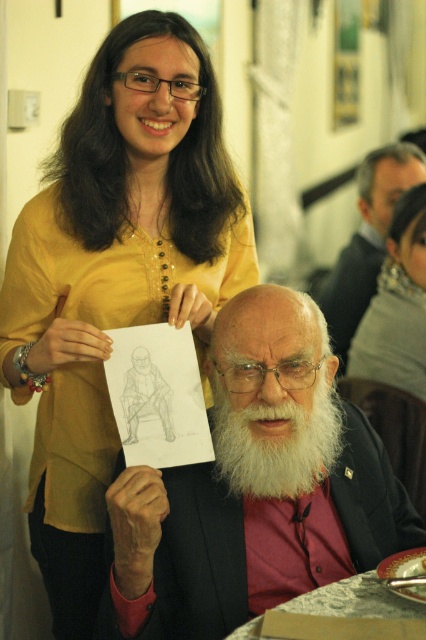
Can you confirm if white fluffy beard at center is smaller than silver metallic table at lower center?

No.

Is white fluffy beard at center shorter than silver metallic table at lower center?

Incorrect, white fluffy beard at center's height does not fall short of silver metallic table at lower center's.

Find the location of a particular element. This screenshot has height=640, width=426. white fluffy beard at center is located at coordinates (276, 442).

The image size is (426, 640). Find the location of `white fluffy beard at center`. white fluffy beard at center is located at coordinates (276, 442).

Is white beard at center further to the viewer compared to white fluffy beard at center?

No, white beard at center is in front of white fluffy beard at center.

The width and height of the screenshot is (426, 640). What do you see at coordinates (255, 486) in the screenshot?
I see `white beard at center` at bounding box center [255, 486].

Is point (146, 536) more distant than point (319, 444)?

No, it is not.

I want to click on white beard at center, so click(x=255, y=486).

Who is shorter, white beard at center or gray hair at upper center?

white beard at center is shorter.

Who is more distant from viewer, [192,573] or [368,241]?

Point [368,241]

Is point (287, 592) farther from viewer compared to point (379, 195)?

No, it is in front of (379, 195).

Where is `white beard at center`? The image size is (426, 640). white beard at center is located at coordinates (255, 486).